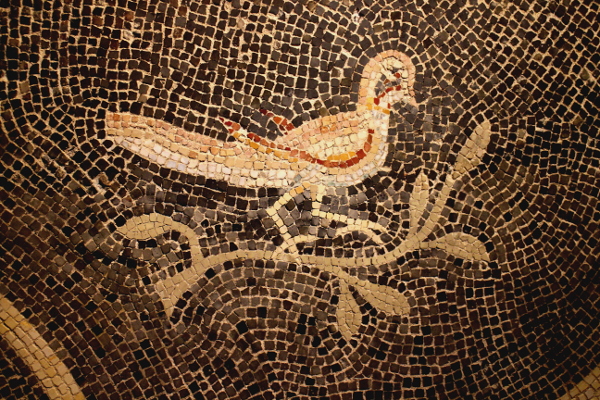
Where is `dark brown tile`? This screenshot has height=400, width=600. dark brown tile is located at coordinates (176, 247).